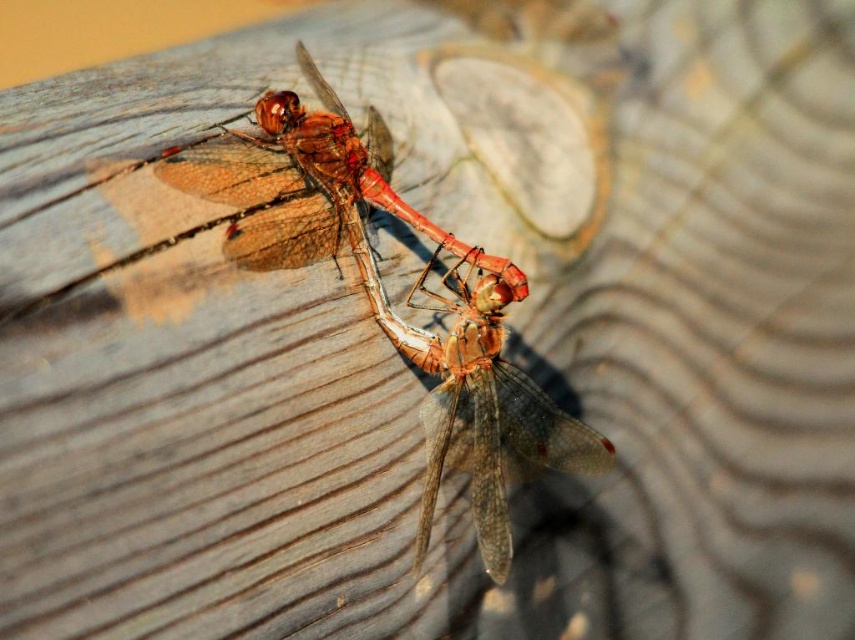
Is point (337, 163) in front of point (258, 266)?

That is False.

Is the position of translucent amber wings at center more distant than that of translucent amber wings at upper center?

Yes, it is.

Is point (270, 237) behind point (506, 280)?

No.

At what (x,y) coordinates should I click in order to perform the action: click on translucent amber wings at center. Please return your answer as a coordinate pair (x, y). Image resolution: width=855 pixels, height=640 pixels. Looking at the image, I should click on (386, 296).

Does translucent amber dragonfly at center have a lesser width compared to translucent amber wings at upper center?

Yes.

Is translucent amber dragonfly at center in front of translucent amber wings at upper center?

No, it is behind translucent amber wings at upper center.

Is point (351, 202) positioned behind point (326, 236)?

Yes, it is behind point (326, 236).

The height and width of the screenshot is (640, 855). I want to click on translucent amber dragonfly at center, so click(x=470, y=388).

How distant is translucent amber wings at center from translucent amber dragonfly at center?

They are 0.85 inches apart.

Is translucent amber wings at center wider than translucent amber dragonfly at center?

Correct, the width of translucent amber wings at center exceeds that of translucent amber dragonfly at center.

Who is more distant from viewer, (x=298, y=230) or (x=492, y=524)?

The point (x=298, y=230) is behind.

I want to click on translucent amber wings at center, so click(386, 296).